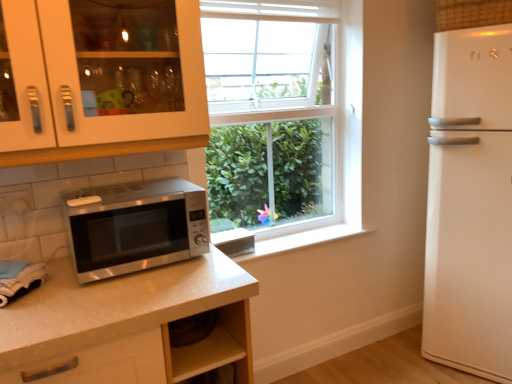
Question: Is white glossy refrigerator at right oriented away from satin silver microwave at lower left?

Choices:
 (A) yes
 (B) no

Answer: (B)

Question: Are white glossy refrigerator at right and satin silver microwave at lower left far apart?

Choices:
 (A) no
 (B) yes

Answer: (B)

Question: From a real-world perspective, is white glossy refrigerator at right on top of satin silver microwave at lower left?

Choices:
 (A) no
 (B) yes

Answer: (A)

Question: Is white glossy refrigerator at right beside satin silver microwave at lower left?

Choices:
 (A) yes
 (B) no

Answer: (B)

Question: Could satin silver microwave at lower left be considered to be inside white glossy refrigerator at right?

Choices:
 (A) no
 (B) yes

Answer: (A)

Question: From a real-world perspective, relative to satin silver microwave at lower left, is white glossy cabinet at upper left vertically above or below?

Choices:
 (A) below
 (B) above

Answer: (B)

Question: In the image, is white glossy cabinet at upper left positioned in front of or behind satin silver microwave at lower left?

Choices:
 (A) behind
 (B) front

Answer: (B)

Question: Choose the correct answer: Is white glossy cabinet at upper left inside satin silver microwave at lower left or outside it?

Choices:
 (A) outside
 (B) inside

Answer: (A)

Question: Considering the positions of white glossy cabinet at upper left and satin silver microwave at lower left in the image, is white glossy cabinet at upper left taller or shorter than satin silver microwave at lower left?

Choices:
 (A) tall
 (B) short

Answer: (A)

Question: Is white glossy refrigerator at right bigger or smaller than white glossy cabinet at upper left?

Choices:
 (A) big
 (B) small

Answer: (A)

Question: From a real-world perspective, is white glossy refrigerator at right positioned above or below white glossy cabinet at upper left?

Choices:
 (A) above
 (B) below

Answer: (B)

Question: Is point (502, 223) positioned closer to the camera than point (60, 0)?

Choices:
 (A) farther
 (B) closer

Answer: (A)

Question: From the image's perspective, is white glossy refrigerator at right positioned above or below white glossy cabinet at upper left?

Choices:
 (A) above
 (B) below

Answer: (B)

Question: Visually, is satin silver microwave at lower left positioned to the left or to the right of white glossy refrigerator at right?

Choices:
 (A) right
 (B) left

Answer: (B)

Question: In terms of width, does satin silver microwave at lower left look wider or thinner when compared to white glossy refrigerator at right?

Choices:
 (A) thin
 (B) wide

Answer: (A)